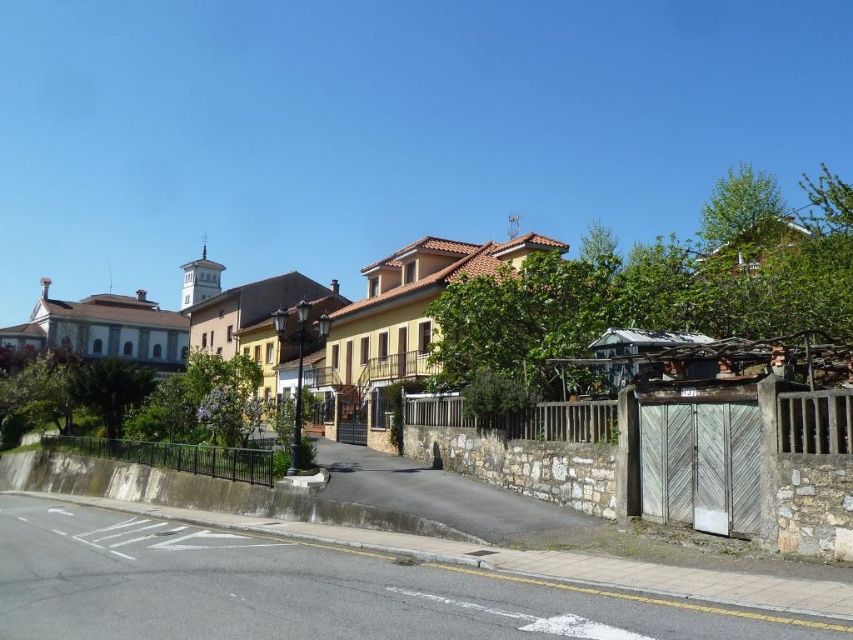
You are a delivery person approaching the street scene. You need to place a package in the area between the wooden fence at center and the black metal fence at lower left. Which fence should you place the package closer to in order to be closer to both fences?

The wooden fence at center is in front of the black metal fence at lower left, so placing the package closer to the wooden fence at center would make it closer to both fences.

You are a delivery person trying to navigate through the street. You see the wooden fence at center and the black metal fence at lower left. Which fence is closer to you?

The black metal fence at lower left is closer to you because it is located below the wooden fence at center, meaning it is in a lower position in the image which typically corresponds to being nearer to the observer.

You are standing at the lamppost near the center of the street scene. You see two points marked on the ground ahead of you, one at coordinates point (462, 404) and another at point (84, 451). Which point is closer to your current position?

Point (462, 404) is closer to the viewer than point (84, 451), so the point at (462, 404) is closer to your current position at the lamppost.